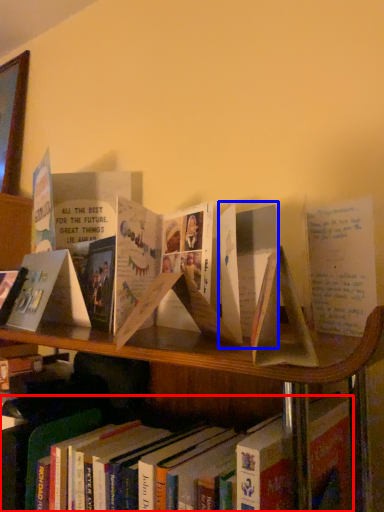
Question: Among these objects, which one is farthest to the camera, book (highlighted by a red box) or paperback book (highlighted by a blue box)?

Choices:
 (A) book
 (B) paperback book

Answer: (A)